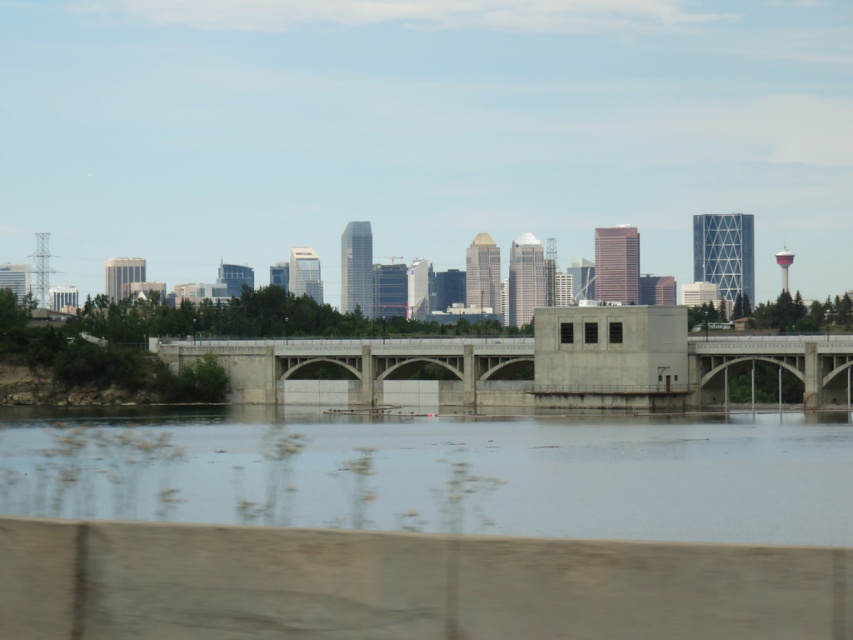
Can you confirm if clear water at center is thinner than concrete bridge at center?

In fact, clear water at center might be wider than concrete bridge at center.

Who is more forward, (125, 449) or (492, 368)?

Point (125, 449) is in front.

Which is in front, point (546, 477) or point (354, 390)?

Point (546, 477) is more forward.

The width and height of the screenshot is (853, 640). Find the location of `clear water at center`. clear water at center is located at coordinates (445, 474).